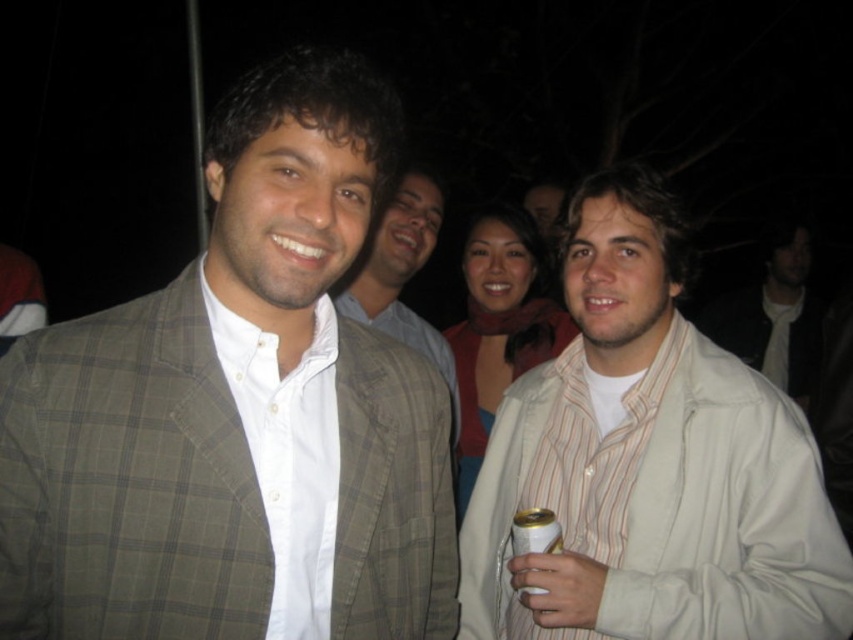
You are a photographer at the event and want to capture a photo that includes both the plaid wool blazer at center and the gold metallic can at lower center. Which object will appear larger in the photo?

The plaid wool blazer at center will appear larger in the photo because it is closer to the viewer than the gold metallic can at lower center.

You are at a nighttime gathering and see the matte gray suit at center and the gold metallic can at lower center. Which object is located higher up in the image?

The matte gray suit at center is positioned over the gold metallic can at lower center, so it is higher up in the image.

You are at a party and want to find the plaid wool blazer at center. Where should you look?

You should look at point (238, 412) to find the plaid wool blazer at center.